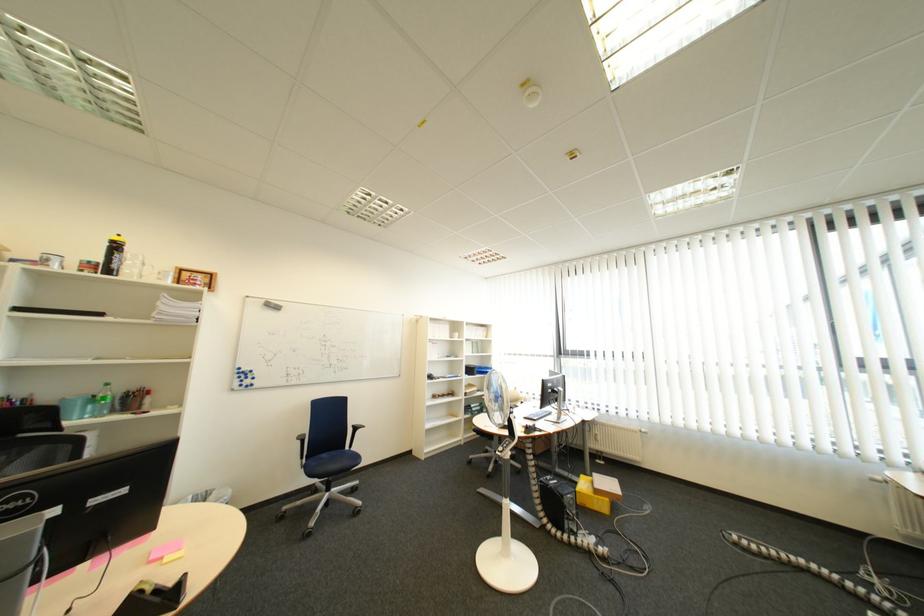
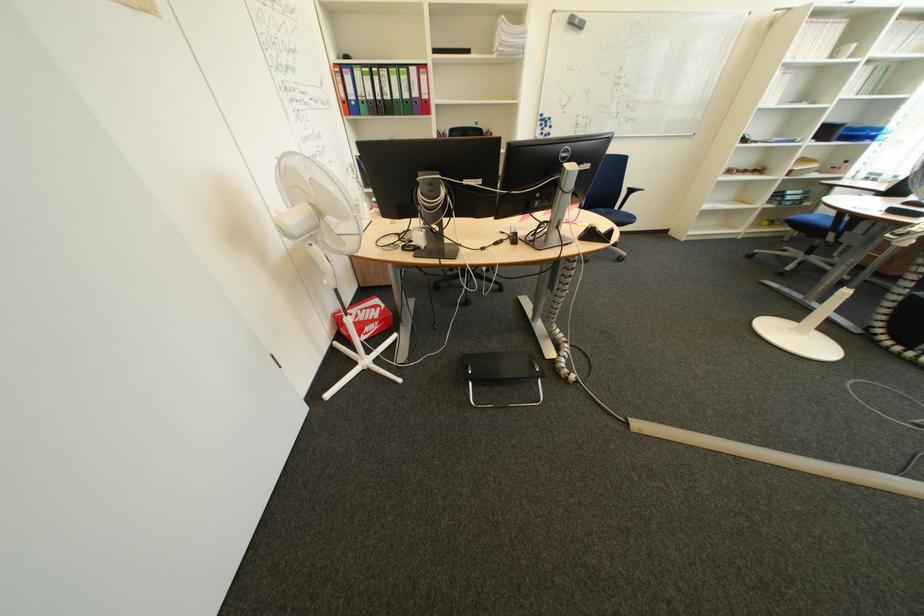
Find the pixel in the second image that matches pixel 136 492 in the first image.

(601, 168)